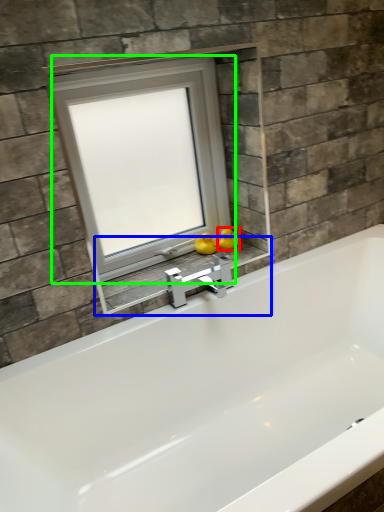
Question: Which is nearer to the duck (highlighted by a red box)? window sill (highlighted by a blue box) or window (highlighted by a green box).

Choices:
 (A) window sill
 (B) window

Answer: (A)